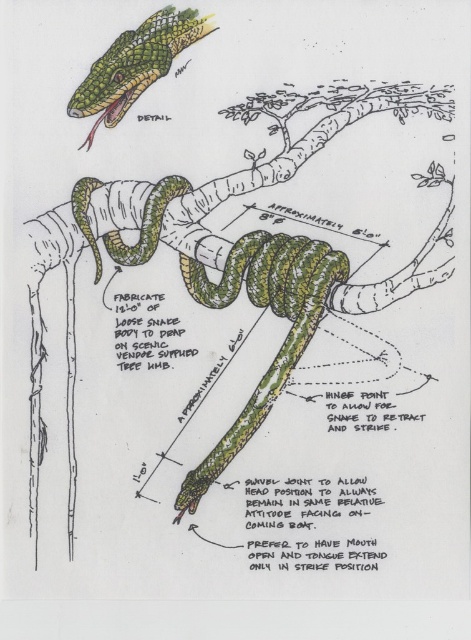
Question: Which point appears closest to the camera in this image?

Choices:
 (A) (154, 58)
 (B) (311, 276)

Answer: (A)

Question: Is green scaly snake at center wider than green scaly snake at upper left?

Choices:
 (A) yes
 (B) no

Answer: (A)

Question: Is the position of green scaly snake at center more distant than that of green scaly snake at upper left?

Choices:
 (A) yes
 (B) no

Answer: (A)

Question: Which point is closer to the camera taking this photo?

Choices:
 (A) (191, 35)
 (B) (193, 289)

Answer: (A)

Question: From the image, what is the correct spatial relationship of green scaly snake at center in relation to green scaly snake at upper left?

Choices:
 (A) right
 (B) left

Answer: (A)